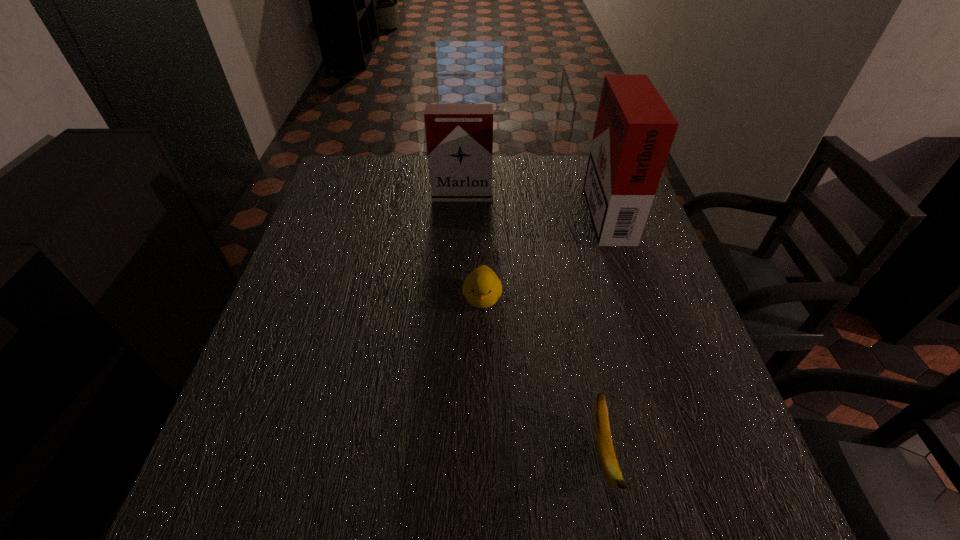
In order to click on vacant space that's between the second tallest object and the right cigarette_case in this screenshot , I will do `click(534, 202)`.

Find the location of a particular element. This screenshot has width=960, height=540. free space between the third object from left to right and the shorter cigarette_case is located at coordinates (533, 325).

You are a GUI agent. You are given a task and a screenshot of the screen. Output one action in this format:
    pyautogui.click(x=<x>, y=<y>)
    Task: Click on the object that is the closest to the left cigarette_case
    
    Given the screenshot: What is the action you would take?
    634,131

Where is `the third closest object to the shorter cigarette_case`? The image size is (960, 540). the third closest object to the shorter cigarette_case is located at coordinates (610, 467).

At what (x,y) coordinates should I click in order to perform the action: click on free space that satisfies the following two spatial constraints: 1. on the front-facing side of the rightmost object; 2. on the front-facing side of the third tallest object. Please return your answer as a coordinate pair (x, y). This screenshot has width=960, height=540. Looking at the image, I should click on (636, 298).

Where is `vacant space that satisfies the following two spatial constraints: 1. on the front-facing side of the rightmost object; 2. on the front-facing side of the third farthest object`? vacant space that satisfies the following two spatial constraints: 1. on the front-facing side of the rightmost object; 2. on the front-facing side of the third farthest object is located at coordinates (636, 298).

Image resolution: width=960 pixels, height=540 pixels. I want to click on vacant point that satisfies the following two spatial constraints: 1. on the front-facing side of the rightmost object; 2. at the stem of the third object from left to right, so click(x=686, y=455).